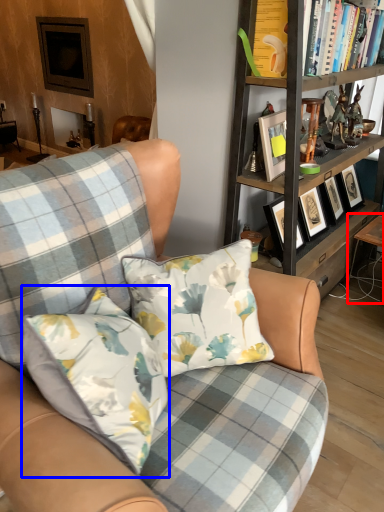
Question: Among these objects, which one is farthest to the camera, table (highlighted by a red box) or pillow (highlighted by a blue box)?

Choices:
 (A) table
 (B) pillow

Answer: (A)